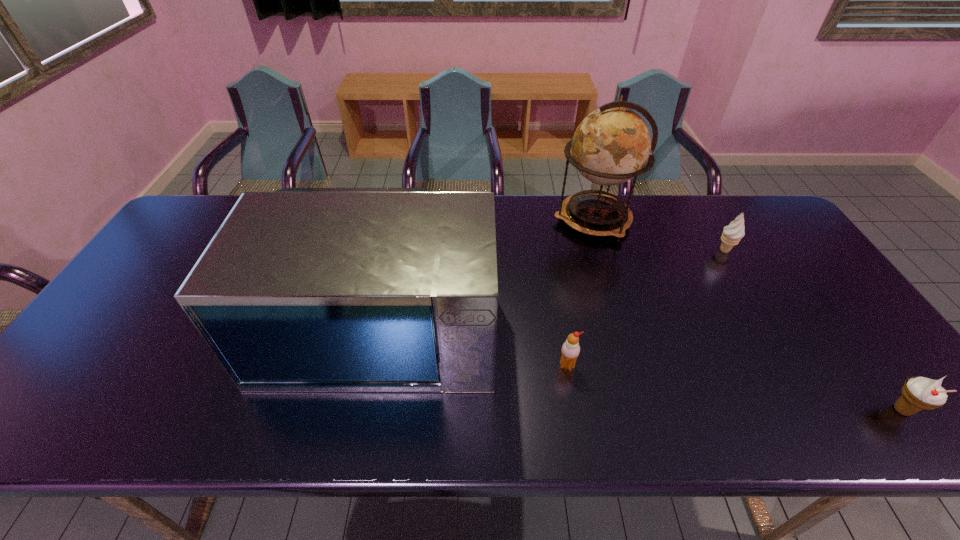
Locate an element on the screen. icecream that is the second nearest to the second object from left to right is located at coordinates (918, 393).

Where is `free space that satisfies the following two spatial constraints: 1. on the front-facing side of the second tallest object; 2. on the right side of the nearest object`? This screenshot has height=540, width=960. free space that satisfies the following two spatial constraints: 1. on the front-facing side of the second tallest object; 2. on the right side of the nearest object is located at coordinates (364, 410).

Locate an element on the screen. vacant space that satisfies the following two spatial constraints: 1. on the front-facing side of the fourth shortest object; 2. on the left side of the nearest icecream is located at coordinates (364, 410).

Locate an element on the screen. The image size is (960, 540). free region that satisfies the following two spatial constraints: 1. at the center of the globe; 2. on the left side of the rightmost icecream is located at coordinates (649, 410).

Identify the location of vacant area in the image that satisfies the following two spatial constraints: 1. at the center of the third object from right to left; 2. at the front with a straw on the fourth object from right to left. The width and height of the screenshot is (960, 540). (636, 366).

The image size is (960, 540). What are the coordinates of `free space that satisfies the following two spatial constraints: 1. at the center of the third object from right to left; 2. on the front-facing side of the microwave oven` in the screenshot? It's located at (623, 321).

Image resolution: width=960 pixels, height=540 pixels. Find the location of `free region that satisfies the following two spatial constraints: 1. on the front-facing side of the farthest icecream; 2. at the front with a straw on the leftmost icecream`. free region that satisfies the following two spatial constraints: 1. on the front-facing side of the farthest icecream; 2. at the front with a straw on the leftmost icecream is located at coordinates (793, 366).

At what (x,y) coordinates should I click in order to perform the action: click on vacant area that satisfies the following two spatial constraints: 1. on the back side of the nearest object; 2. on the front-facing side of the fourth object from left to right. Please return your answer as a coordinate pair (x, y). Looking at the image, I should click on (785, 251).

Identify the location of free space that satisfies the following two spatial constraints: 1. at the center of the third object from left to right; 2. on the front-facing side of the leftmost object. This screenshot has height=540, width=960. (623, 321).

Locate an element on the screen. The image size is (960, 540). vacant point that satisfies the following two spatial constraints: 1. at the center of the globe; 2. on the front-facing side of the second tallest object is located at coordinates (623, 321).